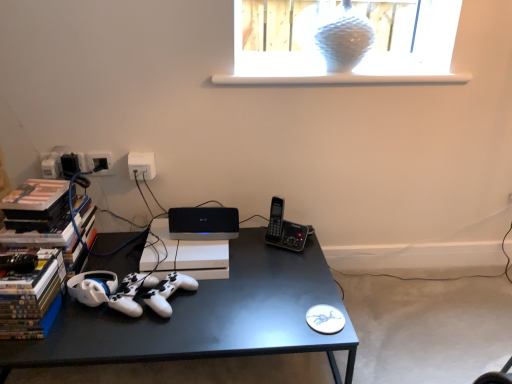
Locate an element on the screen. vacant region above black matte desk at center (from a real-world perspective) is located at coordinates (183, 287).